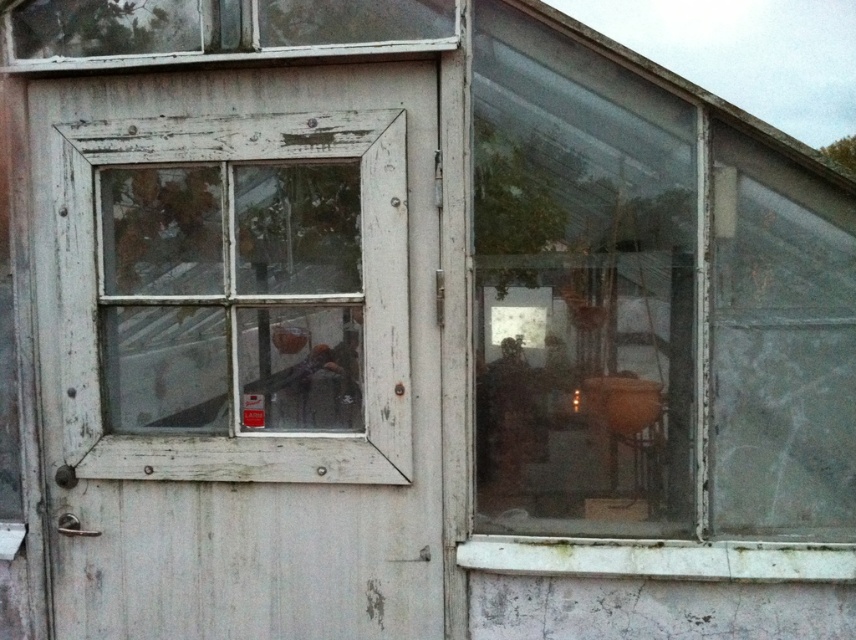
Question: Does white wood screen door at left appear under transparent glass window at upper right?

Choices:
 (A) no
 (B) yes

Answer: (B)

Question: Which object appears closest to the camera in this image?

Choices:
 (A) transparent glass window at upper right
 (B) white wood screen door at left

Answer: (A)

Question: Can you confirm if white wood screen door at left is smaller than transparent glass window at upper right?

Choices:
 (A) yes
 (B) no

Answer: (B)

Question: Among these objects, which one is nearest to the camera?

Choices:
 (A) white wood screen door at left
 (B) transparent glass window at upper right

Answer: (B)

Question: Which object is closer to the camera taking this photo?

Choices:
 (A) transparent glass window at upper right
 (B) white wood screen door at left

Answer: (A)

Question: Can you confirm if white wood screen door at left is thinner than transparent glass window at upper right?

Choices:
 (A) no
 (B) yes

Answer: (A)